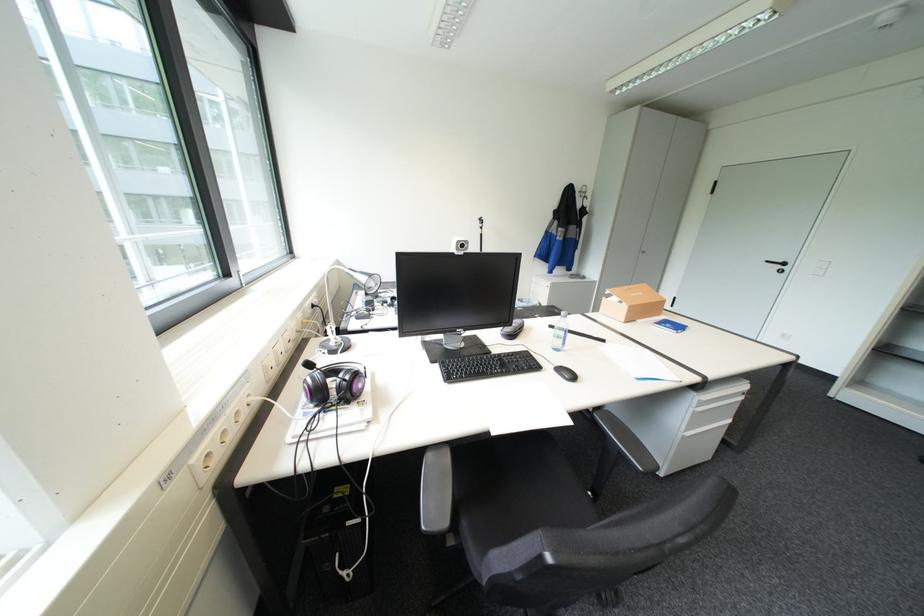
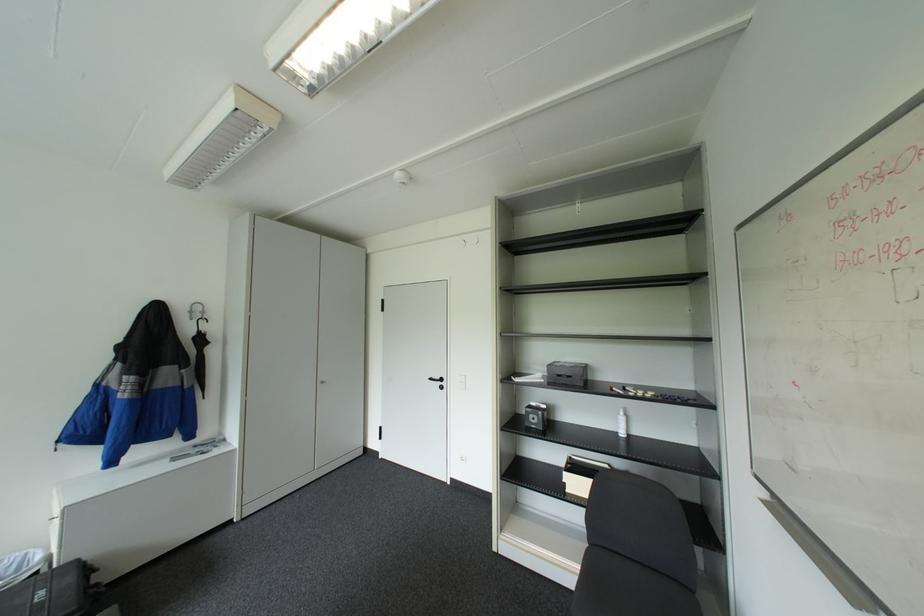
The point at (590,196) is marked in the first image. Where is the corresponding point in the second image?

(200, 318)